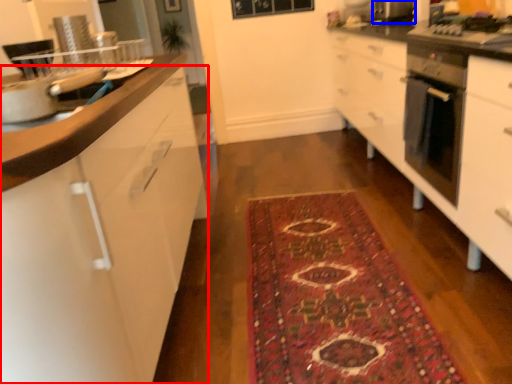
Question: Which object is further to the camera taking this photo, cabinetry (highlighted by a red box) or appliance (highlighted by a blue box)?

Choices:
 (A) cabinetry
 (B) appliance

Answer: (B)